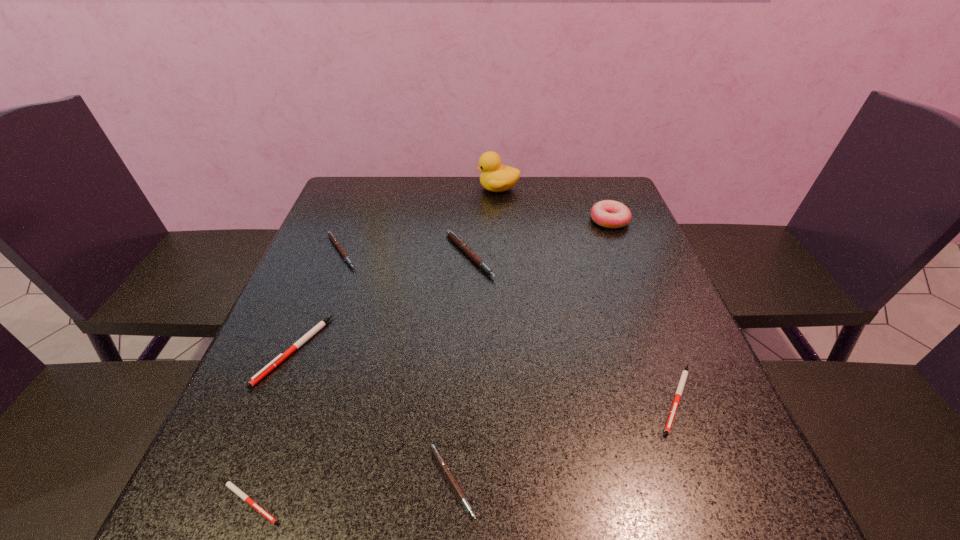
Locate an element on the screen. This screenshot has width=960, height=540. vacant space located at the nib of the smallest pink pen is located at coordinates (671, 481).

This screenshot has width=960, height=540. I want to click on free location located 0.130m on the clicker of the rightmost pen, so click(x=723, y=518).

This screenshot has height=540, width=960. What are the coordinates of `vacant space situated on the clicker of the smallest white pen` in the screenshot? It's located at (456, 502).

Image resolution: width=960 pixels, height=540 pixels. What are the coordinates of `duck present at the far edge` in the screenshot? It's located at (495, 177).

Identify the location of doughnut situated at the far edge. click(607, 213).

Locate an element on the screen. doughnut located in the right edge section of the desktop is located at coordinates (607, 213).

Where is `pen located at the right edge`? Image resolution: width=960 pixels, height=540 pixels. pen located at the right edge is located at coordinates (678, 394).

Where is `object located at the near left corner`? The image size is (960, 540). object located at the near left corner is located at coordinates (230, 485).

Locate an element on the screen. The image size is (960, 540). object present at the far right corner is located at coordinates (607, 213).

In the image, there is a desktop. Where is `vacant area at the far edge`? vacant area at the far edge is located at coordinates 456,198.